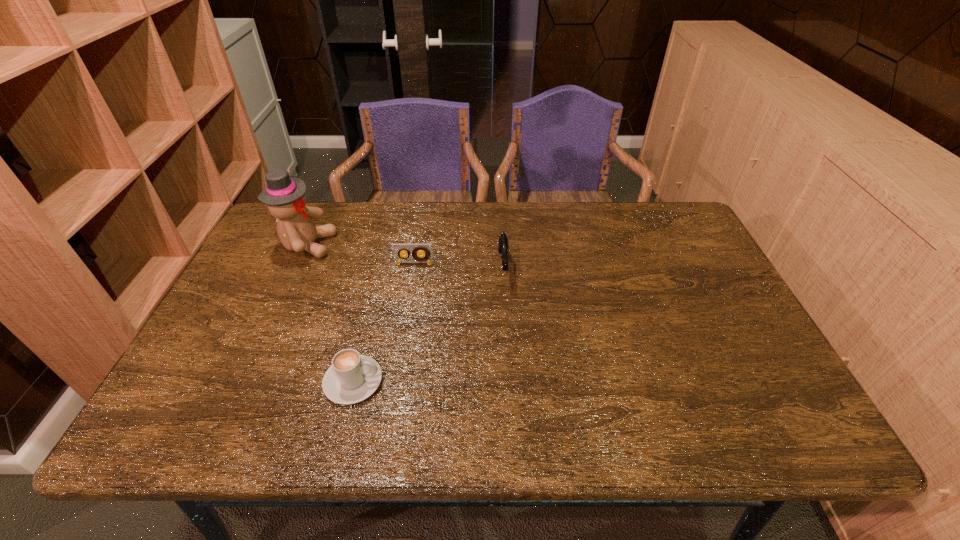
Find the location of a particular element. This screenshot has width=960, height=540. object present at the far edge is located at coordinates (285, 196).

The height and width of the screenshot is (540, 960). Find the location of `object located in the near edge section of the desktop`. object located in the near edge section of the desktop is located at coordinates (351, 378).

Locate an element on the screen. Image resolution: width=960 pixels, height=540 pixels. object at the left edge is located at coordinates (285, 196).

I want to click on object that is at the far left corner, so click(x=285, y=196).

The width and height of the screenshot is (960, 540). In the image, there is a desktop. Identify the location of vacant space at the far edge. (391, 204).

The height and width of the screenshot is (540, 960). In order to click on free space at the near edge of the desktop in this screenshot , I will do `click(648, 434)`.

Locate an element on the screen. The height and width of the screenshot is (540, 960). free space at the right edge is located at coordinates (700, 287).

Locate an element on the screen. vacant region at the near left corner of the desktop is located at coordinates click(x=205, y=429).

Identify the location of vacant space at the far right corner. The width and height of the screenshot is (960, 540). (660, 230).

The height and width of the screenshot is (540, 960). I want to click on vacant area that lies between the nearest object and the leftmost object, so click(330, 313).